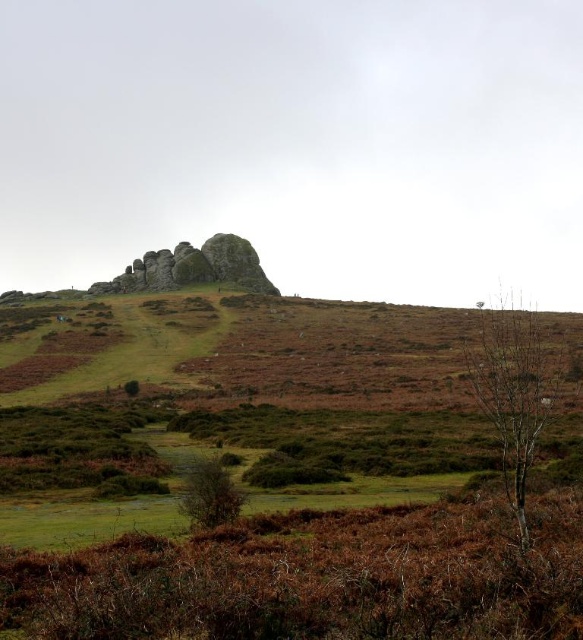
Locate an element on the screen. bare wood at right is located at coordinates (514, 387).

Based on the photo, does rustic stone rock formation at center have a lesser height compared to green matte tree at center?

In fact, rustic stone rock formation at center may be taller than green matte tree at center.

Does rustic stone rock formation at center come in front of green matte tree at center?

No, it is not.

Which is behind, point (156, 280) or point (226, 476)?

Positioned behind is point (156, 280).

In order to click on rustic stone rock formation at center in this screenshot , I will do `click(194, 268)`.

Can you confirm if bare wood at right is taller than green matte tree at center?

Yes.

Which is above, bare wood at right or green matte tree at center?

bare wood at right

Does point (491, 420) come behind point (203, 516)?

Yes, point (491, 420) is farther from viewer.

The image size is (583, 640). What are the coordinates of `bare wood at right` in the screenshot? It's located at (514, 387).